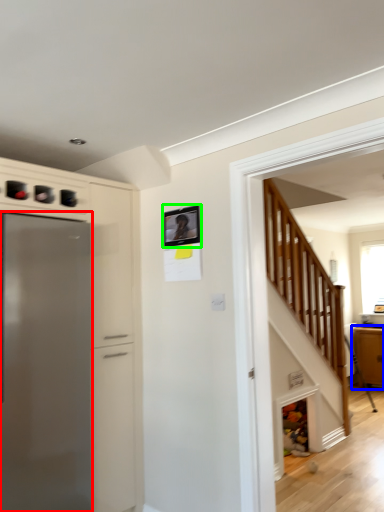
Question: Based on their relative distances, which object is nearer to refrigerator (highlighted by a red box)? Choose from cabinetry (highlighted by a blue box) and picture frame (highlighted by a green box).

Choices:
 (A) cabinetry
 (B) picture frame

Answer: (B)